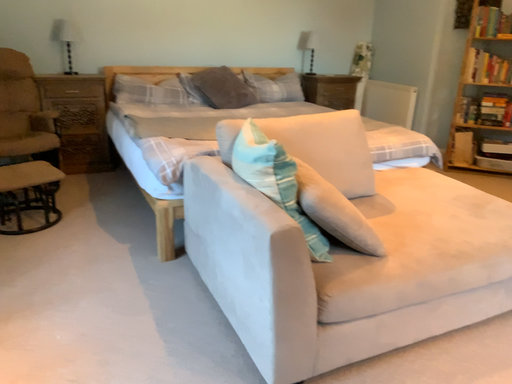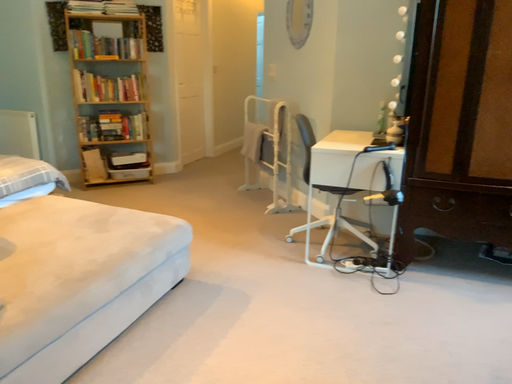
Question: How did the camera likely rotate when shooting the video?

Choices:
 (A) rotated right
 (B) rotated left

Answer: (A)